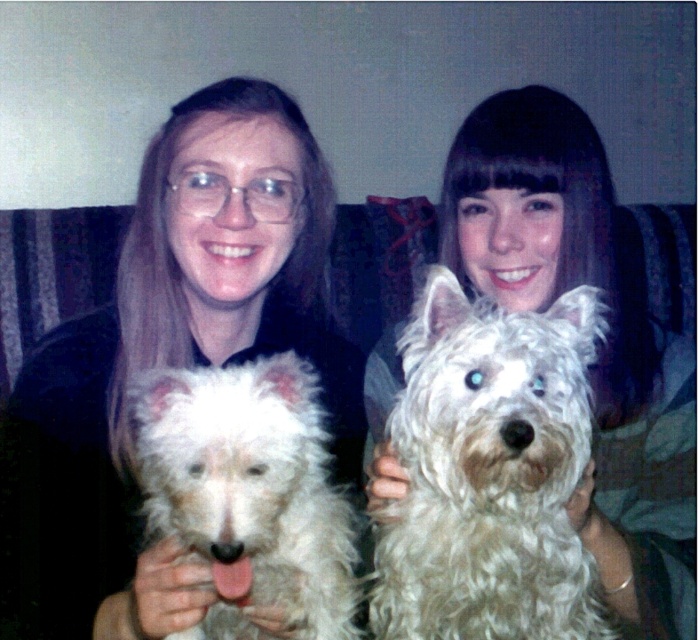
You are taking a photo of the matte black shirt at center and the white fluffy dog at center. Which object is closer to the camera?

The matte black shirt at center is closer to the camera because the white fluffy dog at center is behind it.

You are taking a photo of two people holding dogs. You want to focus on the point closer to the camera. Which point should you choose between point (x=440, y=477) and point (x=281, y=396)?

Point (x=440, y=477) is closer to the camera than point (x=281, y=396), so you should choose point (x=440, y=477) to focus on.

You are a photographer trying to capture a closeup of the fluffy white dog at center. The camera you are using has a focusing point at coordinate point (x=489, y=472). Based on the scene description, can you confirm if this focusing point will land on the fluffy white dog at center?

Yes, the point (x=489, y=472) corresponds to the fluffy white dog at center, so the focusing point will land on the dog.